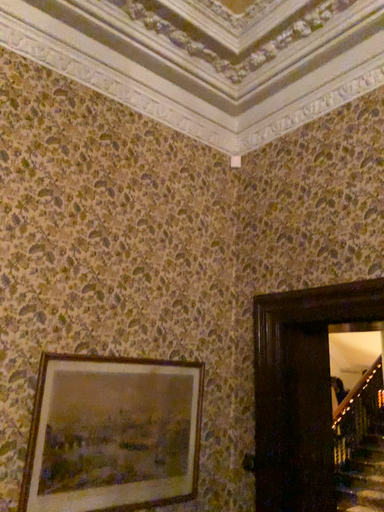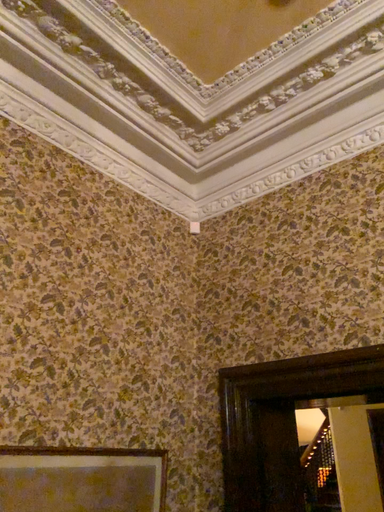
Question: Which way did the camera rotate in the video?

Choices:
 (A) rotated right
 (B) rotated left

Answer: (A)